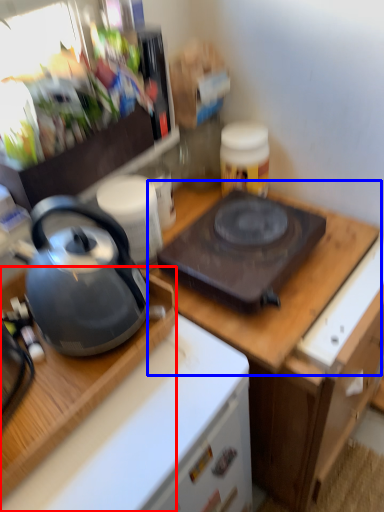
Question: Which object appears farthest to the camera in this image, desk (highlighted by a red box) or counter top (highlighted by a blue box)?

Choices:
 (A) desk
 (B) counter top

Answer: (B)